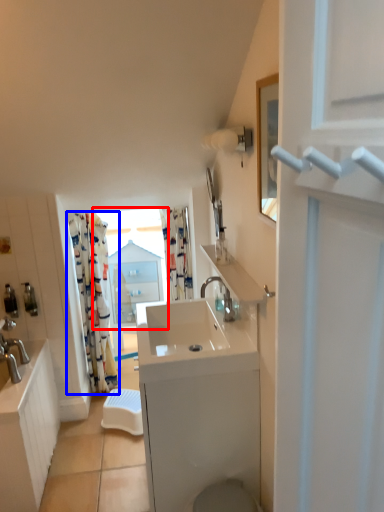
Question: Which object is further to the camera taking this photo, window (highlighted by a red box) or curtain (highlighted by a blue box)?

Choices:
 (A) window
 (B) curtain

Answer: (A)